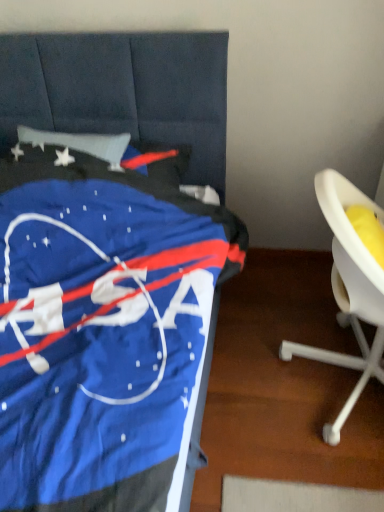
Question: Is blue fabric nasa bedspread at left at the right side of white plastic chair at right?

Choices:
 (A) no
 (B) yes

Answer: (A)

Question: Is blue fabric nasa bedspread at left smaller than white plastic chair at right?

Choices:
 (A) yes
 (B) no

Answer: (B)

Question: Is blue fabric nasa bedspread at left turned away from white plastic chair at right?

Choices:
 (A) yes
 (B) no

Answer: (B)

Question: Considering the relative sizes of blue fabric nasa bedspread at left and white plastic chair at right in the image provided, is blue fabric nasa bedspread at left shorter than white plastic chair at right?

Choices:
 (A) no
 (B) yes

Answer: (B)

Question: Is blue fabric nasa bedspread at left at the left side of white plastic chair at right?

Choices:
 (A) no
 (B) yes

Answer: (B)

Question: Is blue fabric nasa bedspread at left with white plastic chair at right?

Choices:
 (A) no
 (B) yes

Answer: (A)

Question: Is white plastic chair at right positioned behind blue fabric nasa bedspread at left?

Choices:
 (A) no
 (B) yes

Answer: (B)

Question: Is white plastic chair at right located outside blue fabric nasa bedspread at left?

Choices:
 (A) no
 (B) yes

Answer: (B)

Question: From the image's perspective, is white plastic chair at right below blue fabric nasa bedspread at left?

Choices:
 (A) no
 (B) yes

Answer: (B)

Question: Is white plastic chair at right facing towards blue fabric nasa bedspread at left?

Choices:
 (A) yes
 (B) no

Answer: (B)

Question: Considering the relative sizes of white plastic chair at right and blue fabric nasa bedspread at left in the image provided, is white plastic chair at right bigger than blue fabric nasa bedspread at left?

Choices:
 (A) yes
 (B) no

Answer: (B)

Question: From the image's perspective, does white plastic chair at right appear higher than blue fabric nasa bedspread at left?

Choices:
 (A) yes
 (B) no

Answer: (B)

Question: In terms of width, does blue fabric nasa bedspread at left look wider or thinner when compared to white plastic chair at right?

Choices:
 (A) thin
 (B) wide

Answer: (B)